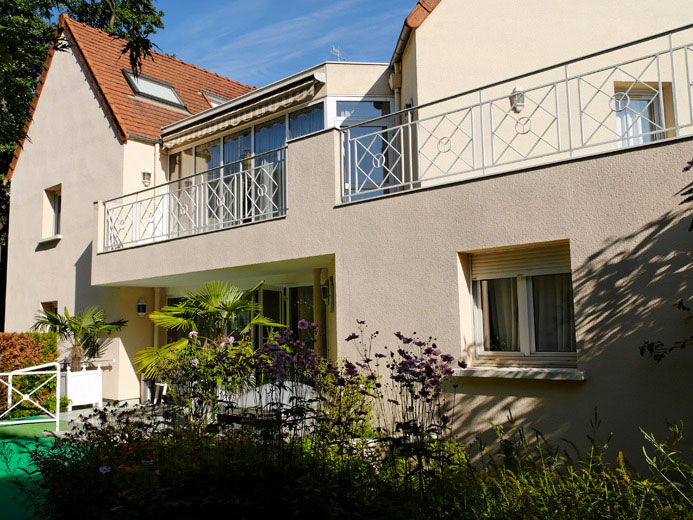
This screenshot has height=520, width=693. Find the location of `plant`. plant is located at coordinates (215, 305).